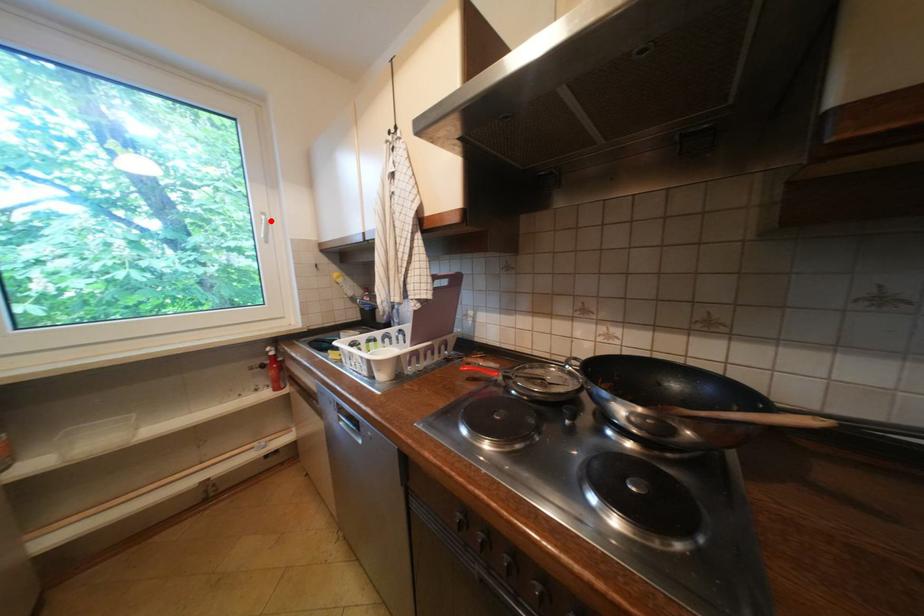
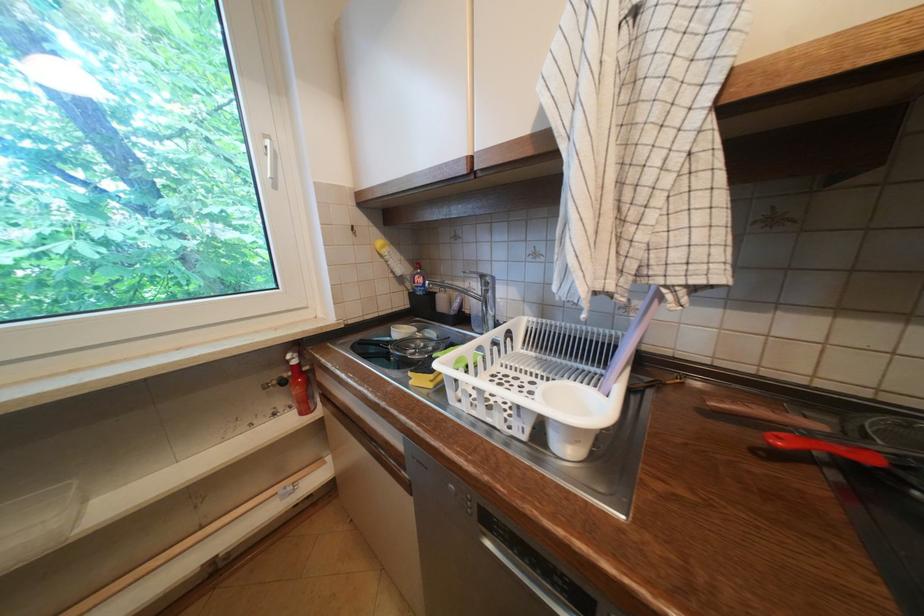
Locate, in the second image, the point that corresponds to the highlighted location in the first image.

(274, 148)